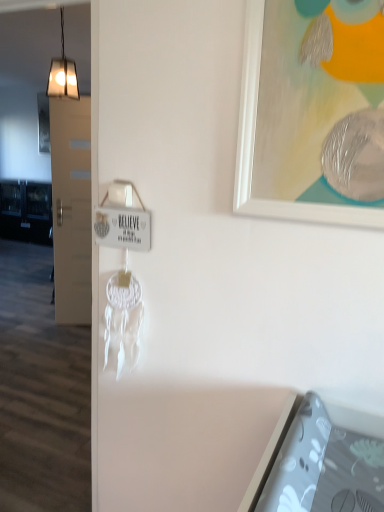
Question: Is point (71, 68) positioned closer to the camera than point (296, 166)?

Choices:
 (A) closer
 (B) farther

Answer: (B)

Question: Relative to white matte picture frame at upper right, is metallic square light fixture at upper left in front or behind?

Choices:
 (A) front
 (B) behind

Answer: (B)

Question: From a real-world perspective, is metallic square light fixture at upper left physically located above or below white matte picture frame at upper right?

Choices:
 (A) below
 (B) above

Answer: (B)

Question: Looking at the image, does white matte picture frame at upper right seem bigger or smaller compared to metallic square light fixture at upper left?

Choices:
 (A) big
 (B) small

Answer: (B)

Question: Considering the positions of white matte picture frame at upper right and metallic square light fixture at upper left in the image, is white matte picture frame at upper right taller or shorter than metallic square light fixture at upper left?

Choices:
 (A) tall
 (B) short

Answer: (B)

Question: From a real-world perspective, is white matte picture frame at upper right positioned above or below metallic square light fixture at upper left?

Choices:
 (A) above
 (B) below

Answer: (B)

Question: From the image's perspective, is white matte picture frame at upper right located above or below metallic square light fixture at upper left?

Choices:
 (A) above
 (B) below

Answer: (B)